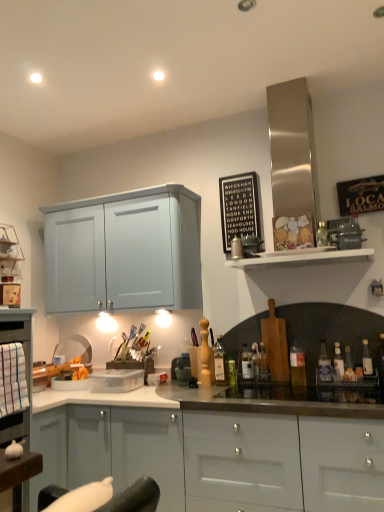
Question: Is black wood sign at upper center oriented away from metallic silver toaster at upper center, placed as the second appliance when sorted from front to back?

Choices:
 (A) no
 (B) yes

Answer: (A)

Question: Is the position of black wood sign at upper center more distant than that of metallic silver toaster at upper center, placed as the second appliance when sorted from front to back?

Choices:
 (A) yes
 (B) no

Answer: (A)

Question: Is black wood sign at upper center wider than metallic silver toaster at upper center, the 2th appliance positioned from the bottom?

Choices:
 (A) yes
 (B) no

Answer: (B)

Question: Is black wood sign at upper center to the right of metallic silver toaster at upper center, which appears as the 2th appliance when viewed from the left, from the viewer's perspective?

Choices:
 (A) yes
 (B) no

Answer: (B)

Question: From the image's perspective, does black wood sign at upper center appear higher than metallic silver toaster at upper center, the 2th appliance positioned from the bottom?

Choices:
 (A) no
 (B) yes

Answer: (B)

Question: Is black wood sign at upper center taller or shorter than translucent glass bottle at center, the fifth bottle when ordered from left to right?

Choices:
 (A) tall
 (B) short

Answer: (A)

Question: Does point (238, 212) appear closer or farther from the camera than point (263, 350)?

Choices:
 (A) closer
 (B) farther

Answer: (B)

Question: In terms of width, does black wood sign at upper center look wider or thinner when compared to translucent glass bottle at center, the fifth bottle when ordered from left to right?

Choices:
 (A) thin
 (B) wide

Answer: (A)

Question: Considering their positions, is black wood sign at upper center located in front of or behind translucent glass bottle at center, the fifth bottle when ordered from left to right?

Choices:
 (A) behind
 (B) front

Answer: (A)

Question: From their relative heights in the image, would you say white wooden shelf at upper right is taller or shorter than metallic silver appliance at upper right, the first appliance positioned from the front?

Choices:
 (A) short
 (B) tall

Answer: (A)

Question: Is point (326, 246) positioned closer to the camera than point (357, 225)?

Choices:
 (A) farther
 (B) closer

Answer: (B)

Question: Is white wooden shelf at upper right bigger or smaller than metallic silver appliance at upper right, which is the 1th appliance in top-to-bottom order?

Choices:
 (A) big
 (B) small

Answer: (A)

Question: From a real-world perspective, relative to metallic silver appliance at upper right, the 3th appliance in the back-to-front sequence, is white wooden shelf at upper right vertically above or below?

Choices:
 (A) above
 (B) below

Answer: (B)

Question: Is white wooden shelf at upper right spatially inside clear glass bottle at right, the seventh bottle positioned from the left, or outside of it?

Choices:
 (A) inside
 (B) outside

Answer: (B)

Question: In terms of height, does white wooden shelf at upper right look taller or shorter compared to clear glass bottle at right, the seventh bottle positioned from the left?

Choices:
 (A) short
 (B) tall

Answer: (A)